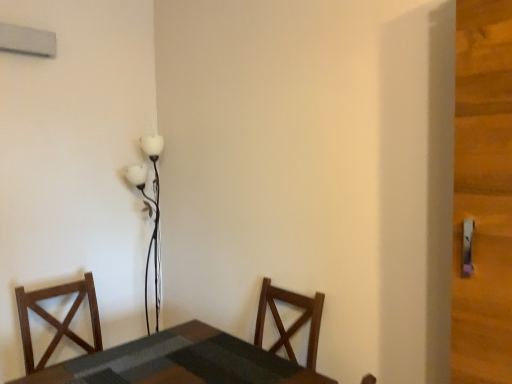
Measure the distance between point (141, 172) and camera.

A distance of 8.39 feet exists between point (141, 172) and camera.

Locate an element on the screen. The width and height of the screenshot is (512, 384). white glossy floor lamp at upper center is located at coordinates (149, 212).

Describe the element at coordinates (56, 319) in the screenshot. The image size is (512, 384). I see `dark wood chair at left` at that location.

Image resolution: width=512 pixels, height=384 pixels. In order to click on smooth dark wood table at lower left in this screenshot , I will do `click(182, 362)`.

Can you confirm if smooth dark wood table at lower left is positioned to the left of dark wood chair at left?

In fact, smooth dark wood table at lower left is to the right of dark wood chair at left.

Which point is more distant from viewer, (187, 328) or (29, 350)?

The point (187, 328) is behind.

Can you confirm if smooth dark wood table at lower left is taller than dark wood chair at left?

In fact, smooth dark wood table at lower left may be shorter than dark wood chair at left.

From the image's perspective, is dark wood chair at left above or below white glossy floor lamp at upper center?

dark wood chair at left is below white glossy floor lamp at upper center.

How many degrees apart are the facing directions of dark wood chair at left and white glossy floor lamp at upper center?

They differ by 7.86 degrees in their facing directions.

Is dark wood chair at left oriented towards white glossy floor lamp at upper center?

No, dark wood chair at left is not turned towards white glossy floor lamp at upper center.

From a real-world perspective, is dark wood chair at left positioned under white glossy floor lamp at upper center based on gravity?

Correct, in the physical world, dark wood chair at left is lower than white glossy floor lamp at upper center.

Consider the image. Are smooth dark wood table at lower left and white glossy floor lamp at upper center making contact?

No, smooth dark wood table at lower left is not in contact with white glossy floor lamp at upper center.

The height and width of the screenshot is (384, 512). In order to click on table beneath the white glossy floor lamp at upper center (from a real-world perspective) in this screenshot , I will do `click(182, 362)`.

Does smooth dark wood table at lower left turn towards white glossy floor lamp at upper center?

No, smooth dark wood table at lower left is not turned towards white glossy floor lamp at upper center.

Who is smaller, white glossy floor lamp at upper center or dark wood chair at left?

Smaller between the two is white glossy floor lamp at upper center.

From a real-world perspective, between white glossy floor lamp at upper center and dark wood chair at left, who is vertically higher?

white glossy floor lamp at upper center is physically above.

Is white glossy floor lamp at upper center positioned with its back to dark wood chair at left?

No.

From the image's perspective, does white glossy floor lamp at upper center appear lower than dark wood chair at left?

Actually, white glossy floor lamp at upper center appears above dark wood chair at left in the image.

Based on the photo, which of these two, white glossy floor lamp at upper center or smooth dark wood table at lower left, is thinner?

white glossy floor lamp at upper center.

From the image's perspective, which one is positioned lower, white glossy floor lamp at upper center or smooth dark wood table at lower left?

smooth dark wood table at lower left, from the image's perspective.

Could you tell me if white glossy floor lamp at upper center is turned towards smooth dark wood table at lower left?

No, white glossy floor lamp at upper center is not aimed at smooth dark wood table at lower left.

Considering the relative sizes of white glossy floor lamp at upper center and smooth dark wood table at lower left in the image provided, is white glossy floor lamp at upper center bigger than smooth dark wood table at lower left?

Incorrect, white glossy floor lamp at upper center is not larger than smooth dark wood table at lower left.

Which is closer to the camera, (88, 347) or (225, 340)?

Point (88, 347) appears to be farther away from the viewer than point (225, 340).

In the scene shown: From a real-world perspective, is dark wood chair at left above or below smooth dark wood table at lower left?

Clearly, from a real-world perspective, dark wood chair at left is above smooth dark wood table at lower left.

This screenshot has height=384, width=512. What are the coordinates of `table that appears in front of the dark wood chair at left` in the screenshot? It's located at tap(182, 362).

Identify the location of chair below the white glossy floor lamp at upper center (from the image's perspective). Image resolution: width=512 pixels, height=384 pixels. click(x=56, y=319).

From the image, which object appears to be farther from smooth dark wood table at lower left, white glossy floor lamp at upper center or dark wood chair at left?

The object further to smooth dark wood table at lower left is white glossy floor lamp at upper center.

Based on their spatial positions, is smooth dark wood table at lower left or dark wood chair at left further from white glossy floor lamp at upper center?

The object further to white glossy floor lamp at upper center is smooth dark wood table at lower left.

Looking at this image, based on their spatial positions, is dark wood chair at left or smooth dark wood table at lower left closer to white glossy floor lamp at upper center?

dark wood chair at left is positioned closer to the anchor white glossy floor lamp at upper center.

Based on the photo, which object lies further to the anchor point dark wood chair at left, smooth dark wood table at lower left or white glossy floor lamp at upper center?

white glossy floor lamp at upper center is further to dark wood chair at left.

Based on their spatial positions, is white glossy floor lamp at upper center or smooth dark wood table at lower left further from dark wood chair at left?

white glossy floor lamp at upper center is further to dark wood chair at left.

Looking at the image, which one is located closer to smooth dark wood table at lower left, dark wood chair at left or white glossy floor lamp at upper center?

dark wood chair at left is positioned closer to the anchor smooth dark wood table at lower left.

I want to click on chair located between smooth dark wood table at lower left and white glossy floor lamp at upper center in the depth direction, so click(x=56, y=319).